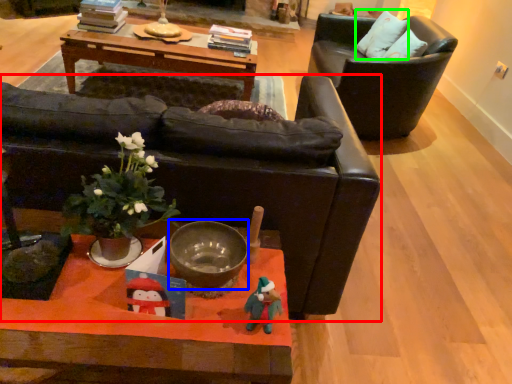
Question: Which is nearer to the chair (highlighted by a red box)? bowl (highlighted by a blue box) or pillow (highlighted by a green box).

Choices:
 (A) bowl
 (B) pillow

Answer: (A)